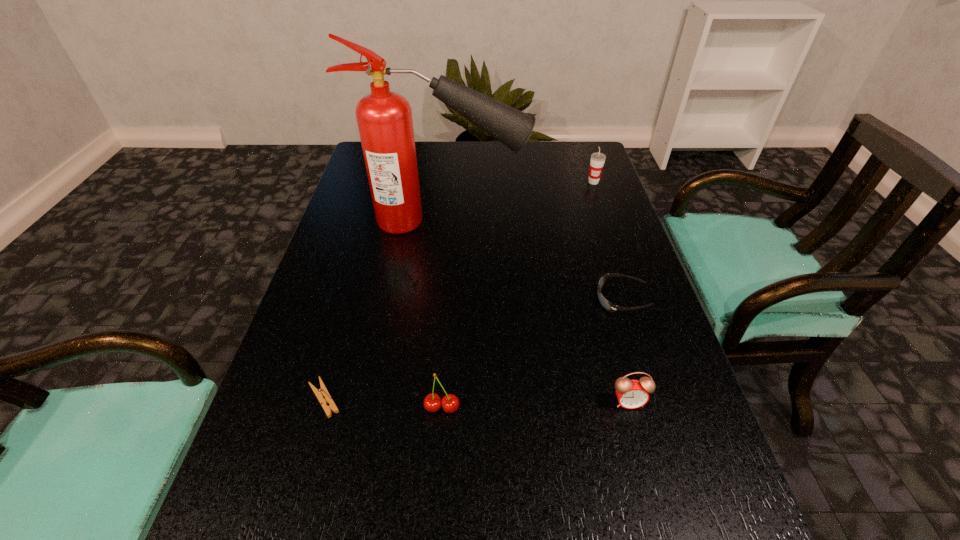
Where is `vacant region that satisfies the following two spatial constraints: 1. at the nozzle of the fifth nearest object; 2. on the front side of the shortest object`? Image resolution: width=960 pixels, height=540 pixels. vacant region that satisfies the following two spatial constraints: 1. at the nozzle of the fifth nearest object; 2. on the front side of the shortest object is located at coordinates (425, 399).

Image resolution: width=960 pixels, height=540 pixels. I want to click on vacant space that satisfies the following two spatial constraints: 1. on the side of the fifth shortest object with the logo; 2. at the nozzle of the tallest object, so click(607, 221).

I want to click on vacant space that satisfies the following two spatial constraints: 1. on the side of the fifth shortest object with the logo; 2. on the lenses of the sunglasses, so click(634, 299).